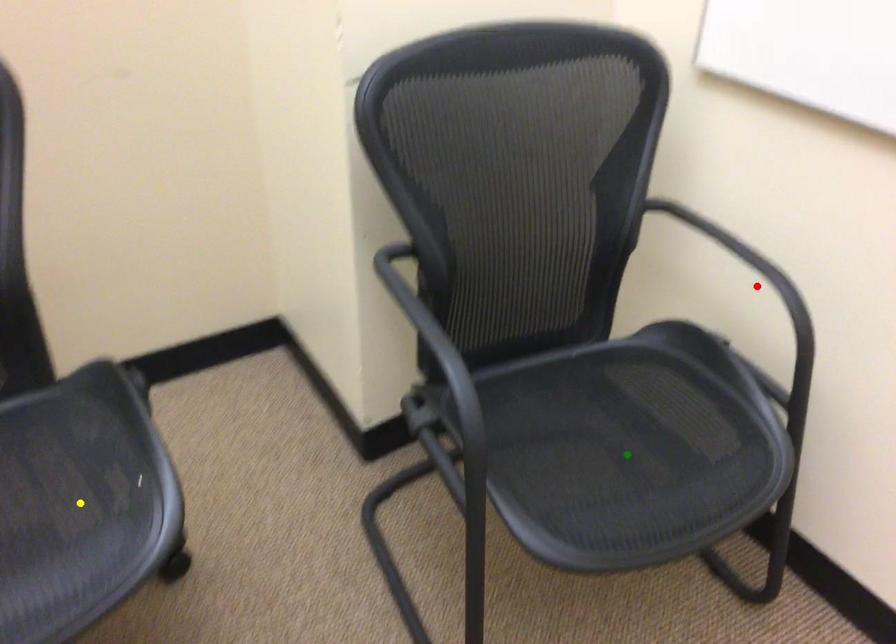
Based on the photo, order these from nearest to farthest:
green point, yellow point, red point

yellow point, green point, red point